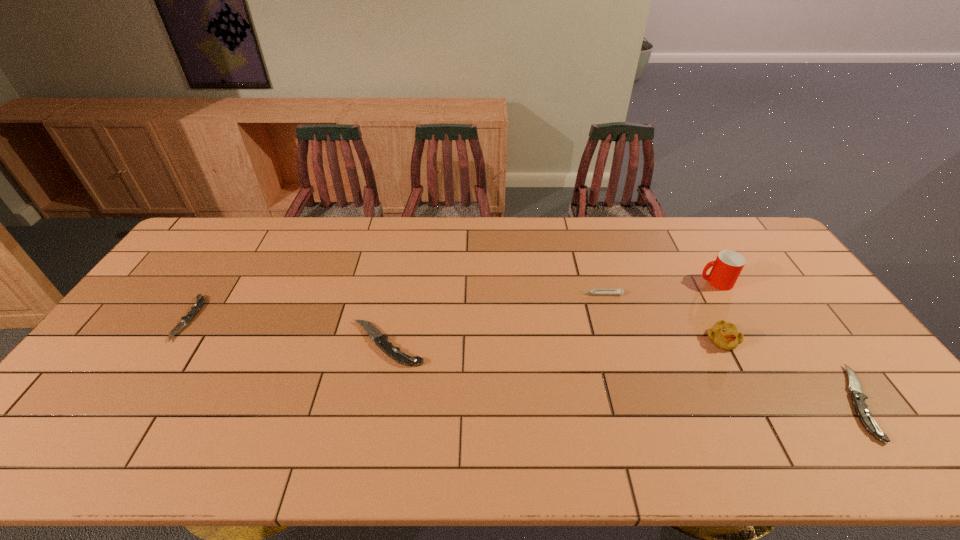
At what (x,y) coordinates should I click in order to perform the action: click on the leftmost pocketknife. Please return your answer as a coordinate pair (x, y). This screenshot has height=540, width=960. Looking at the image, I should click on (199, 303).

Find the location of a particular element. the shortest object is located at coordinates (199, 303).

At what (x,y) coordinates should I click in order to perform the action: click on the fifth object from right to left. Please return your answer as a coordinate pair (x, y). The width and height of the screenshot is (960, 540). Looking at the image, I should click on (380, 340).

Find the location of a particular element. the second tallest pocketknife is located at coordinates (858, 398).

Find the location of a particular element. the rightmost pocketknife is located at coordinates (858, 398).

Locate an element on the screen. The image size is (960, 540). the tallest object is located at coordinates click(x=728, y=265).

Where is `cup`? This screenshot has height=540, width=960. cup is located at coordinates (728, 265).

Locate an element on the screen. duckling is located at coordinates (724, 335).

What are the coordinates of `the fourth object from right to left` in the screenshot? It's located at coord(595,291).

Where is `vacant region located on the right of the leftmost object`? The image size is (960, 540). vacant region located on the right of the leftmost object is located at coordinates (324, 319).